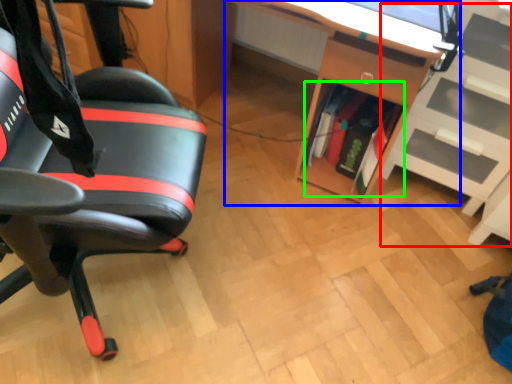
Question: Estimate the real-world distances between objects in this image. Which object is farther from shelf (highlighted by a red box), desk (highlighted by a blue box) or book (highlighted by a green box)?

Choices:
 (A) desk
 (B) book

Answer: (A)